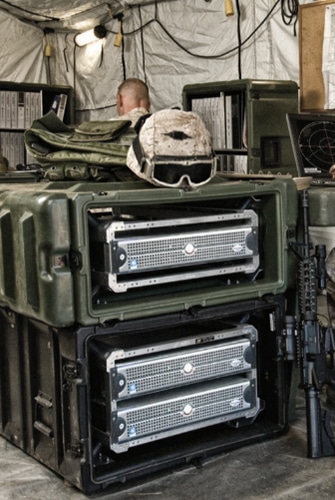
The width and height of the screenshot is (335, 500). Identify the location of 3 light tan hanging cannisters. (49, 52), (115, 40), (230, 9).